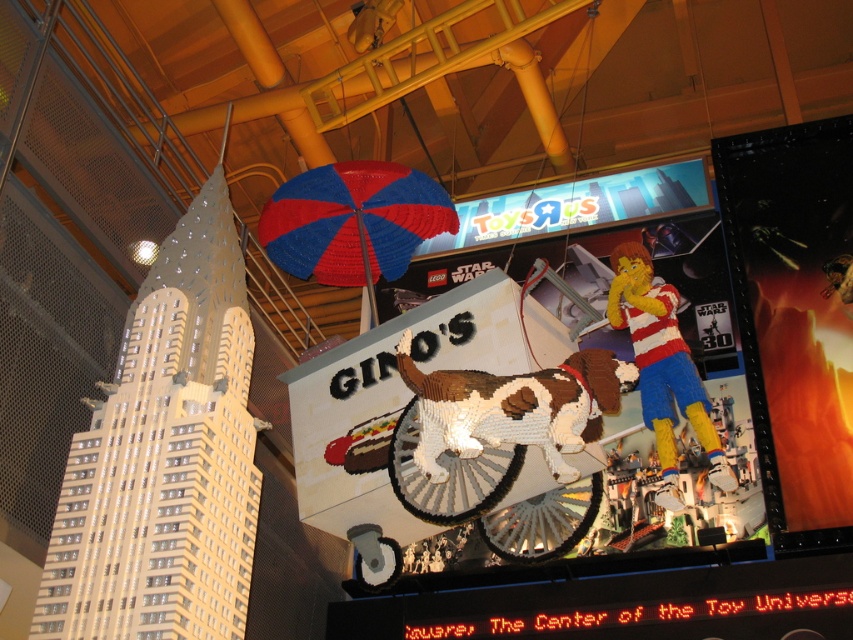
Between point (549, 452) and point (677, 387), which one is positioned behind?

Point (677, 387)

Can you confirm if brown and white plastic dog at center is positioned to the left of plush yellow and red toy at center?

Indeed, brown and white plastic dog at center is positioned on the left side of plush yellow and red toy at center.

Image resolution: width=853 pixels, height=640 pixels. Describe the element at coordinates (514, 408) in the screenshot. I see `brown and white plastic dog at center` at that location.

You are a GUI agent. You are given a task and a screenshot of the screen. Output one action in this format:
    pyautogui.click(x=<x>, y=<y>)
    Task: Click on the brown and white plastic dog at center
    This screenshot has height=640, width=853.
    Given the screenshot: What is the action you would take?
    pyautogui.click(x=514, y=408)

Does plush yellow and red toy at center appear on the left side of matte plastic signboard at center?

In fact, plush yellow and red toy at center is to the right of matte plastic signboard at center.

Between plush yellow and red toy at center and matte plastic signboard at center, which one appears on the right side from the viewer's perspective?

plush yellow and red toy at center is more to the right.

Find the location of `plush yellow and red toy at center`. plush yellow and red toy at center is located at coordinates (662, 369).

In order to click on brown and white plastic dog at center in this screenshot , I will do click(514, 408).

Is brown and white plastic dog at center behind blue/red plastic umbrella at center?

No, it is in front of blue/red plastic umbrella at center.

The image size is (853, 640). Find the location of `brown and white plastic dog at center`. brown and white plastic dog at center is located at coordinates (514, 408).